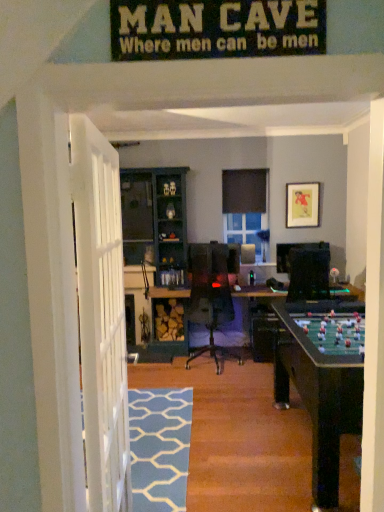
Question: Is blue textured rug at lower center surrounded by matte paper picture frame at upper right?

Choices:
 (A) no
 (B) yes

Answer: (A)

Question: Does matte paper picture frame at upper right have a smaller size compared to blue textured rug at lower center?

Choices:
 (A) yes
 (B) no

Answer: (A)

Question: Considering the relative sizes of matte paper picture frame at upper right and blue textured rug at lower center in the image provided, is matte paper picture frame at upper right taller than blue textured rug at lower center?

Choices:
 (A) no
 (B) yes

Answer: (B)

Question: Could you tell me if matte paper picture frame at upper right is facing blue textured rug at lower center?

Choices:
 (A) no
 (B) yes

Answer: (A)

Question: Is matte paper picture frame at upper right bigger than blue textured rug at lower center?

Choices:
 (A) no
 (B) yes

Answer: (A)

Question: From a real-world perspective, is matte paper picture frame at upper right positioned above or below blue textured rug at lower center?

Choices:
 (A) below
 (B) above

Answer: (B)

Question: In terms of height, does matte paper picture frame at upper right look taller or shorter compared to blue textured rug at lower center?

Choices:
 (A) tall
 (B) short

Answer: (A)

Question: Is matte paper picture frame at upper right wider or thinner than blue textured rug at lower center?

Choices:
 (A) thin
 (B) wide

Answer: (A)

Question: Is matte paper picture frame at upper right to the left or to the right of blue textured rug at lower center in the image?

Choices:
 (A) left
 (B) right

Answer: (B)

Question: Looking at the image, does green felt table at center seem bigger or smaller compared to blue textured rug at lower center?

Choices:
 (A) big
 (B) small

Answer: (A)

Question: In the image, is green felt table at center on the left side or the right side of blue textured rug at lower center?

Choices:
 (A) right
 (B) left

Answer: (A)

Question: Considering the positions of green felt table at center and blue textured rug at lower center in the image, is green felt table at center wider or thinner than blue textured rug at lower center?

Choices:
 (A) thin
 (B) wide

Answer: (B)

Question: Is green felt table at center situated inside blue textured rug at lower center or outside?

Choices:
 (A) outside
 (B) inside

Answer: (A)

Question: Considering the positions of blue painted wood cabinet at center and green felt table at center in the image, is blue painted wood cabinet at center bigger or smaller than green felt table at center?

Choices:
 (A) big
 (B) small

Answer: (A)

Question: Is blue painted wood cabinet at center in front of or behind green felt table at center in the image?

Choices:
 (A) behind
 (B) front

Answer: (A)